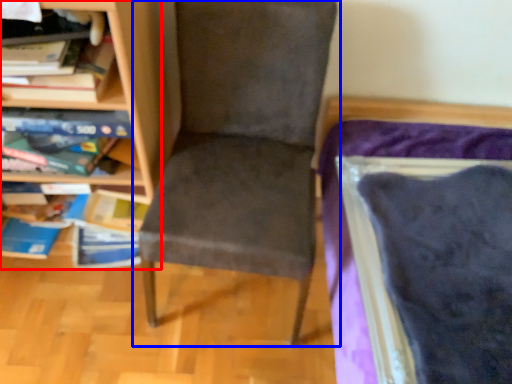
Question: Which object appears farthest to the camera in this image, bookcase (highlighted by a red box) or chair (highlighted by a blue box)?

Choices:
 (A) bookcase
 (B) chair

Answer: (A)